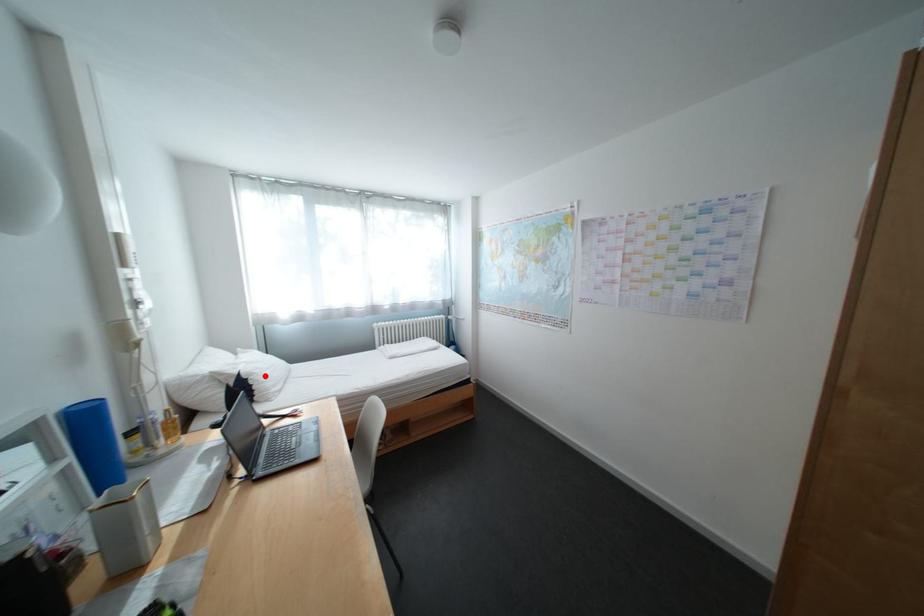
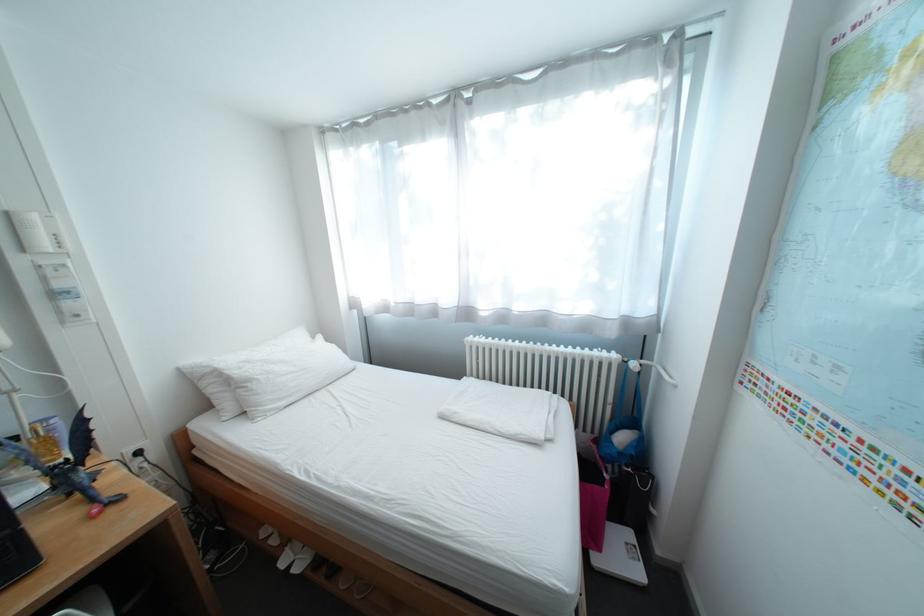
Question: I am providing you with two images of the same scene from different viewpoints. Given a red point in image1, look at the same physical point in image2. Is it:

Choices:
 (A) Closer to the viewpoint
 (B) Farther from the viewpoint

Answer: (B)